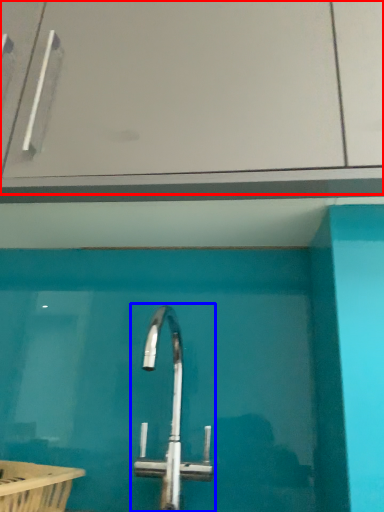
Question: Which point is closer to the camera, glass door (highlighted by a red box) or tap (highlighted by a blue box)?

Choices:
 (A) glass door
 (B) tap

Answer: (B)